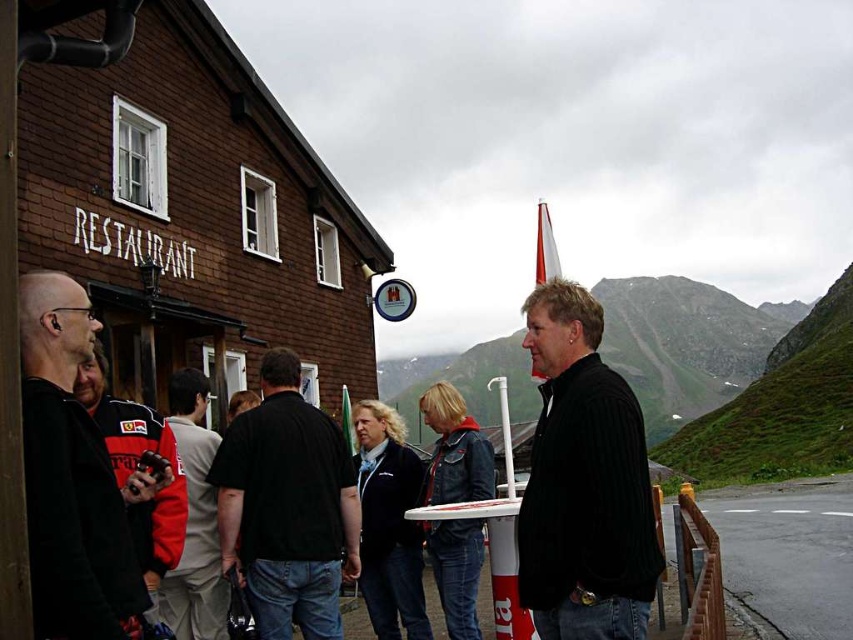
Does black corduroy jacket at center come behind red and black jacket at left?

Yes, it is behind red and black jacket at left.

Is black corduroy jacket at center closer to the viewer compared to red and black jacket at left?

No, black corduroy jacket at center is behind red and black jacket at left.

Between point (599, 499) and point (166, 540), which one is positioned in front?

Point (599, 499)

Where is `black corduroy jacket at center`? black corduroy jacket at center is located at coordinates (583, 481).

Is black matte jacket at left shorter than red and white jacket at center?

Incorrect, black matte jacket at left's height does not fall short of red and white jacket at center's.

Identify the location of black matte jacket at left. (73, 477).

Can you confirm if black matte jacket at left is positioned above red and black jacket at left?

Indeed, black matte jacket at left is positioned over red and black jacket at left.

Which is in front, point (126, 561) or point (173, 445)?

Point (126, 561)

Where is `black matte jacket at left`? The width and height of the screenshot is (853, 640). black matte jacket at left is located at coordinates (73, 477).

This screenshot has width=853, height=640. In order to click on black matte jacket at left in this screenshot , I will do `click(73, 477)`.